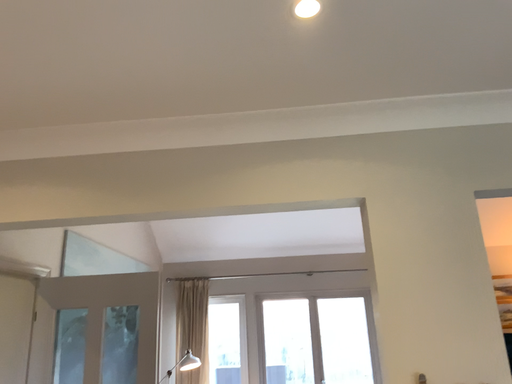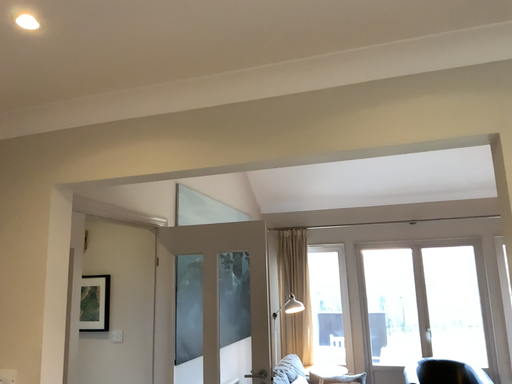
Question: How did the camera likely rotate when shooting the video?

Choices:
 (A) rotated downward
 (B) rotated upward

Answer: (A)